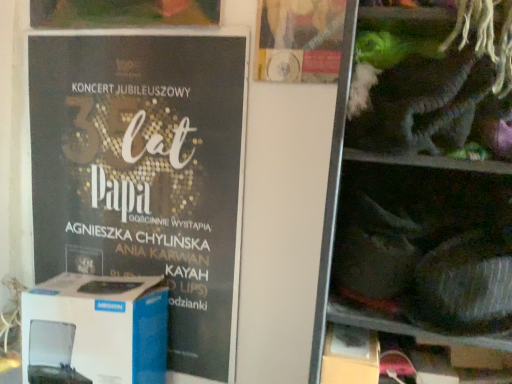
Question: Looking at the image, does white cardboard box at left seem bigger or smaller compared to shiny plastic toys at right?

Choices:
 (A) big
 (B) small

Answer: (B)

Question: Relative to shiny plastic toys at right, is white cardboard box at left in front or behind?

Choices:
 (A) front
 (B) behind

Answer: (B)

Question: Estimate the real-world distances between objects in this image. Which object is farther from the matte gold poster at upper center?

Choices:
 (A) shiny plastic toys at right
 (B) matte black poster at left
 (C) white cardboard box at left

Answer: (C)

Question: Considering the real-world distances, which object is closest to the white cardboard box at left?

Choices:
 (A) shiny plastic toys at right
 (B) matte gold poster at upper center
 (C) matte black poster at left

Answer: (C)